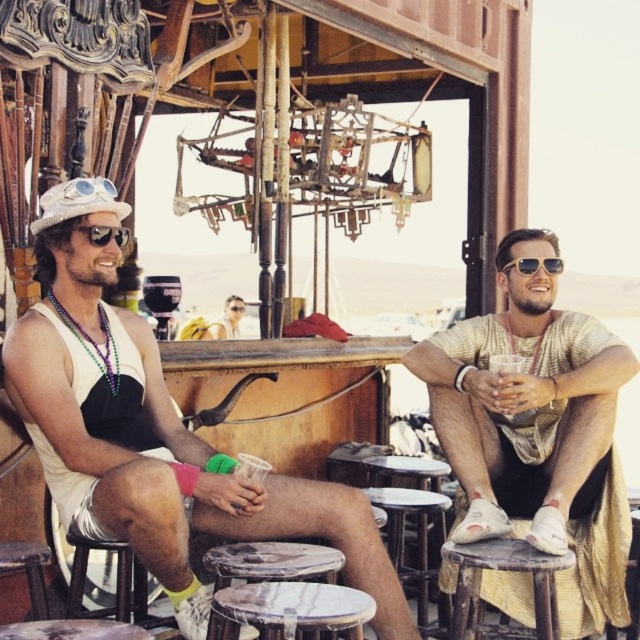
You are a photographer trying to capture a closeup of the matte black sunglasses at center. However, the matte black goggles at left are blocking your view. Can you adjust your angle to see the sunglasses without moving the goggles?

The matte black sunglasses at center is positioned under the matte black goggles at left, so you can lower your angle to look underneath the goggles and still see the sunglasses.

Based on the photo, you are standing in front of the rustic wooden bar in the desert scene. You need to find the matte gold shirt at center. Based on the coordinates provided, where exactly should you look to locate it?

The matte gold shirt at center is located at the 2D coordinates point [525,403].